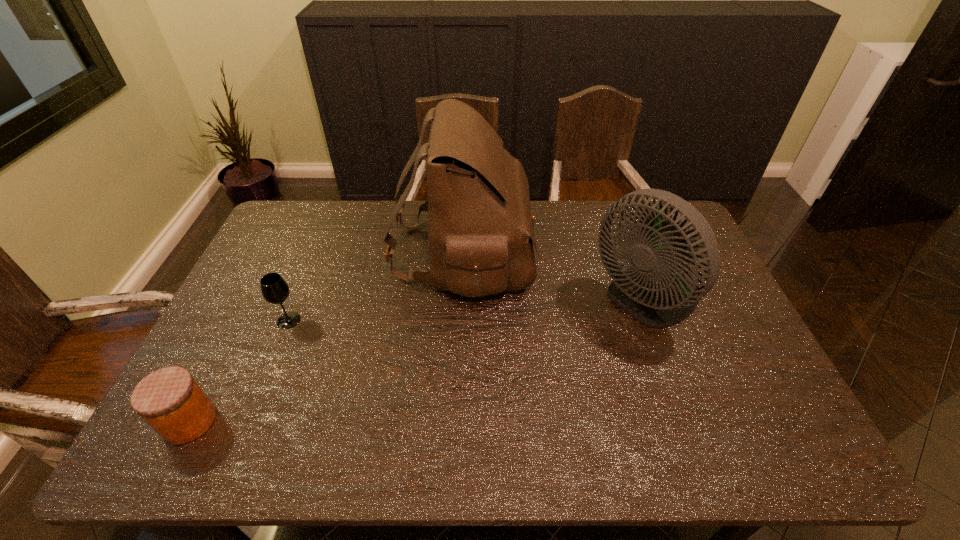
Where is `vacant space at the near edge`? The width and height of the screenshot is (960, 540). vacant space at the near edge is located at coordinates (727, 450).

The height and width of the screenshot is (540, 960). I want to click on vacant space at the left edge of the desktop, so click(x=298, y=260).

Where is `vacant area at the right edge`? The width and height of the screenshot is (960, 540). vacant area at the right edge is located at coordinates (702, 329).

You are a GUI agent. You are given a task and a screenshot of the screen. Output one action in this format:
    pyautogui.click(x=<x>, y=<y>)
    Task: Click on the vacant space at the far left corner
    
    Given the screenshot: What is the action you would take?
    pyautogui.click(x=305, y=237)

This screenshot has width=960, height=540. In the image, there is a desktop. What are the coordinates of `vacant space at the near left corner` in the screenshot? It's located at (175, 447).

Identify the location of unoccupied area between the third object from left to right and the third object from right to left. The image size is (960, 540). (376, 287).

Where is `blank region between the second tallest object and the satchel`? This screenshot has width=960, height=540. blank region between the second tallest object and the satchel is located at coordinates (555, 278).

Where is `free spot between the third shortest object and the shortest object`? This screenshot has width=960, height=540. free spot between the third shortest object and the shortest object is located at coordinates (419, 362).

Find the location of a particular element. This screenshot has height=540, width=960. free point between the third object from right to left and the shortest object is located at coordinates (239, 371).

Image resolution: width=960 pixels, height=540 pixels. Find the location of `unoccupied position between the satchel and the wineglass`. unoccupied position between the satchel and the wineglass is located at coordinates (376, 287).